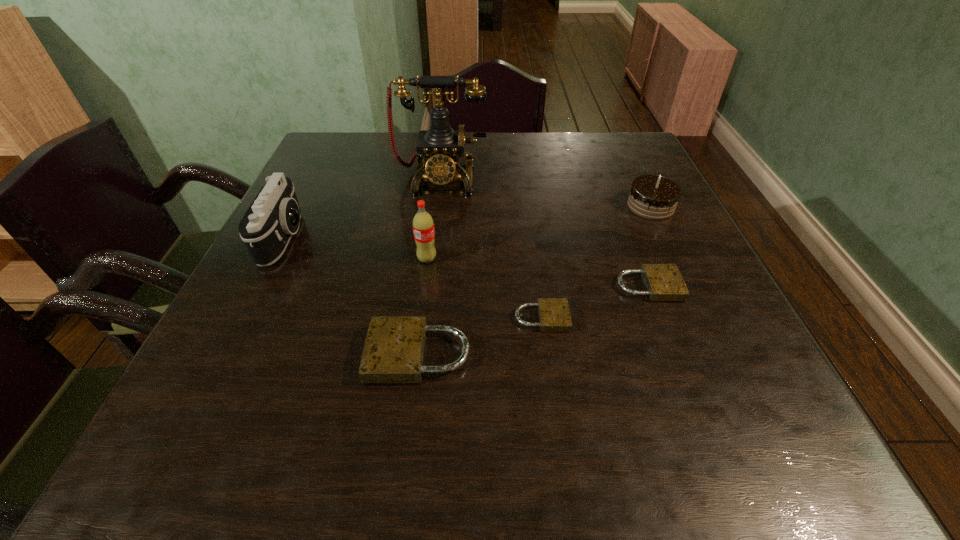
Find the location of a particular element. the fifth closest object to the leftmost object is located at coordinates (663, 282).

Locate an element on the screen. The image size is (960, 540). object that is the closest to the chocolate cake is located at coordinates (663, 282).

Identify the location of padlock that is the third closest to the chocolate cake. Image resolution: width=960 pixels, height=540 pixels. (394, 348).

Point out which padlock is positioned as the second nearest to the fourth tallest object. Please provide its 2D coordinates. Your answer should be formatted as a tuple, i.e. [(x, y)], where the tuple contains the x and y coordinates of a point satisfying the conditions above.

[(554, 315)]

What are the coordinates of `free location that satisfies the following two spatial constraints: 1. on the front of the telephone, featuring the rotary dial; 2. on the front lens of the camera` in the screenshot? It's located at (434, 238).

I want to click on vacant position in the image that satisfies the following two spatial constraints: 1. on the front of the tallest object, featuring the rotary dial; 2. on the front lens of the leftmost object, so click(x=434, y=238).

The width and height of the screenshot is (960, 540). I want to click on blank space that satisfies the following two spatial constraints: 1. on the back side of the fourth shortest object; 2. on the left side of the soda, so coord(434,206).